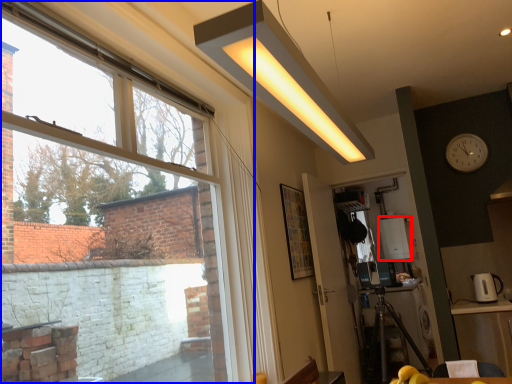
Question: Which of the following is the farthest to the observer, appliance (highlighted by a red box) or window (highlighted by a blue box)?

Choices:
 (A) appliance
 (B) window

Answer: (A)